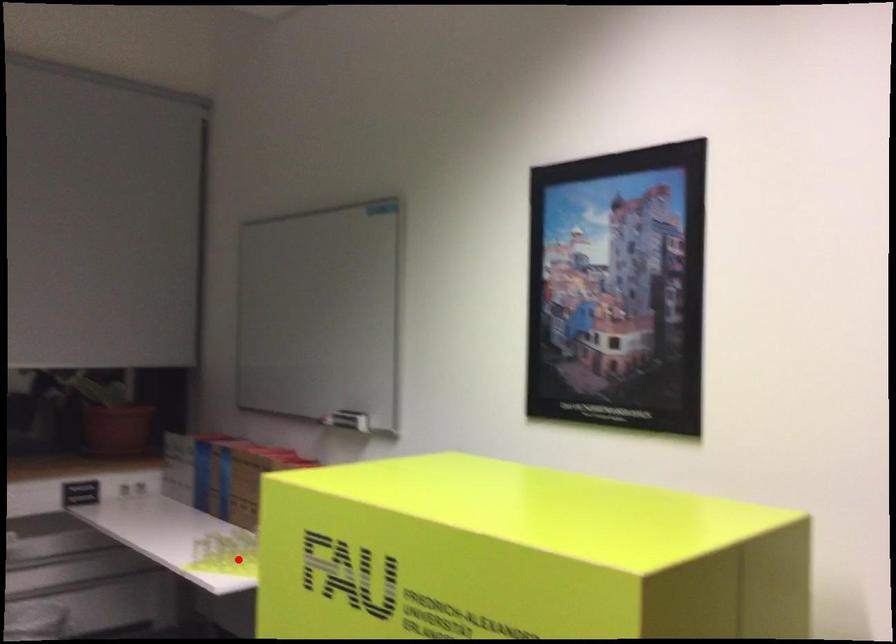
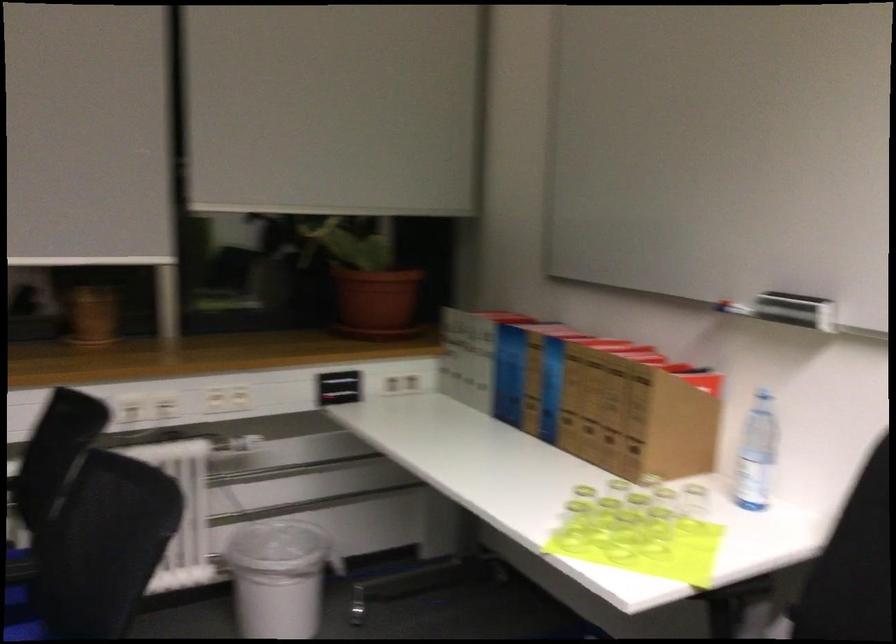
Question: I am providing you with two images of the same scene from different viewpoints. Image1 has a red point marked. In image2, the corresponding 3D location appears at what relative position? Reply with the corresponding letter.

Choices:
 (A) Closer
 (B) Farther

Answer: (A)